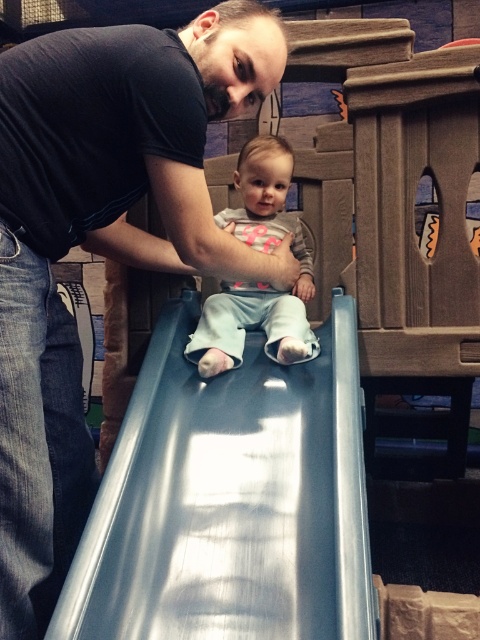
Can you confirm if metallic smooth slide at center is positioned above light blue fabric pants at center?

Actually, metallic smooth slide at center is below light blue fabric pants at center.

Who is more forward, [219,588] or [243,332]?

Point [219,588] is in front.

Locate an element on the screen. The width and height of the screenshot is (480, 640). metallic smooth slide at center is located at coordinates (230, 499).

Can you confirm if black matte shirt at upper left is positioned to the left of light blue fabric pants at center?

Correct, you'll find black matte shirt at upper left to the left of light blue fabric pants at center.

Is black matte shirt at upper left thinner than light blue fabric pants at center?

In fact, black matte shirt at upper left might be wider than light blue fabric pants at center.

Between point (96, 166) and point (260, 308), which one is positioned behind?

Positioned behind is point (260, 308).

You are a GUI agent. You are given a task and a screenshot of the screen. Output one action in this format:
    pyautogui.click(x=<x>, y=<y>)
    Task: Click on the black matte shirt at upper left
    The image size is (480, 640).
    Given the screenshot: What is the action you would take?
    pyautogui.click(x=100, y=241)

Is black matte shirt at upper left positioned at the back of metallic smooth slide at center?

Yes, black matte shirt at upper left is behind metallic smooth slide at center.

Between black matte shirt at upper left and metallic smooth slide at center, which one appears on the left side from the viewer's perspective?

From the viewer's perspective, black matte shirt at upper left appears more on the left side.

Is point (218, 49) in front of point (176, 545)?

No, it is not.

You are a GUI agent. You are given a task and a screenshot of the screen. Output one action in this format:
    pyautogui.click(x=<x>, y=<y>)
    Task: Click on the black matte shirt at upper left
    Image resolution: width=480 pixels, height=640 pixels.
    Given the screenshot: What is the action you would take?
    pyautogui.click(x=100, y=241)